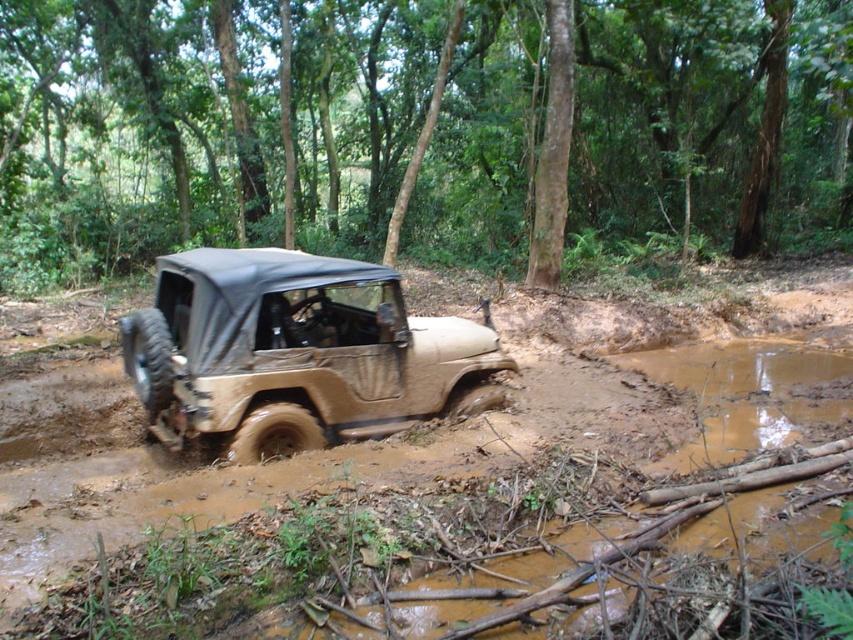
Does brown matte vehicle at center have a larger size compared to tan matte/sand textured jeep at center?

Correct, brown matte vehicle at center is larger in size than tan matte/sand textured jeep at center.

Which is behind, point (564, 76) or point (457, 337)?

Positioned behind is point (564, 76).

What do you see at coordinates (418, 129) in the screenshot?
I see `brown matte vehicle at center` at bounding box center [418, 129].

Find the location of a particular element. The image size is (853, 640). brown matte vehicle at center is located at coordinates (418, 129).